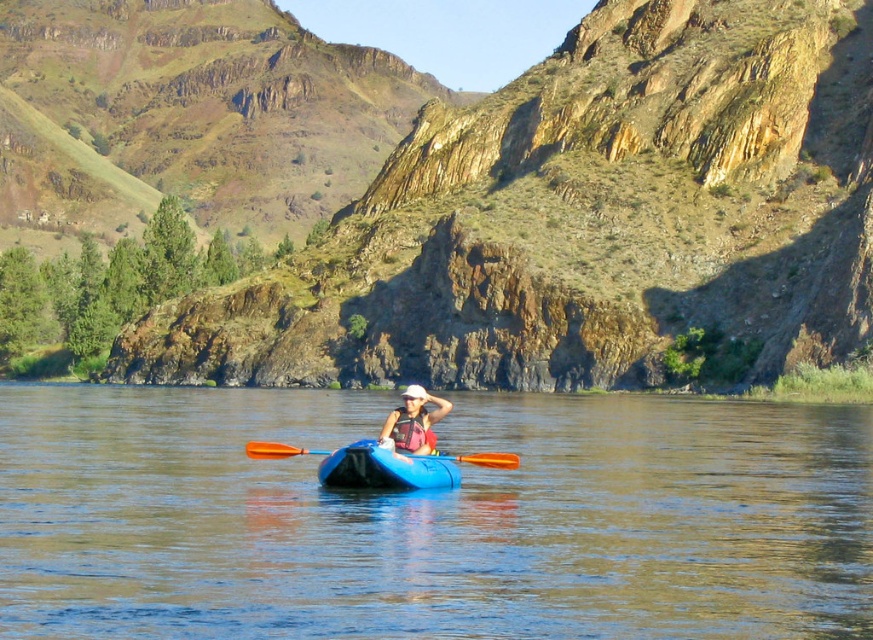
How far apart are blue plastic kayak at center and orange wood paddle at center?

49.81 feet

From the picture: Between blue plastic kayak at center and orange wood paddle at center, which one has less height?

Standing shorter between the two is orange wood paddle at center.

Is point (201, 566) closer to camera compared to point (266, 442)?

Yes.

This screenshot has width=873, height=640. I want to click on blue plastic kayak at center, so click(x=431, y=518).

Between blue plastic kayak at center and matte pink life vest at center, which one is positioned lower?

blue plastic kayak at center is lower down.

Is blue plastic kayak at center wider than matte pink life vest at center?

Correct, the width of blue plastic kayak at center exceeds that of matte pink life vest at center.

What do you see at coordinates (431, 518) in the screenshot? The height and width of the screenshot is (640, 873). I see `blue plastic kayak at center` at bounding box center [431, 518].

I want to click on blue plastic kayak at center, so click(431, 518).

Who is more distant from viewer, (404, 460) or (258, 448)?

Point (258, 448)

Is point (418, 481) more distant than point (482, 452)?

No, it is not.

I want to click on blue plastic canoe at center, so click(386, 468).